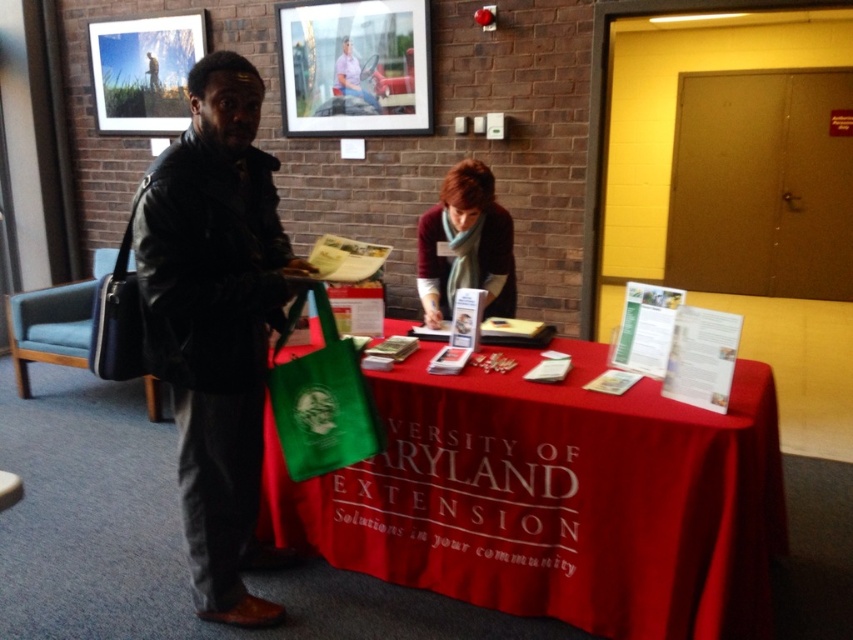
You are at the event and need to place a new sign on the table. The sign must be placed behind the green fabric bag at center but in front of the red cloth at center. Is this possible?

The red cloth at center is in front of the green fabric bag at center, so placing the sign behind the green fabric bag at center would place it further back than the red cloth. However, since the red cloth is already in front of the green bag, there is no space between them to place the sign behind the green bag but in front of the red cloth. Therefore, it is not possible.

You are a visitor at the event and see the red cloth at center and the maroon sweater at center. Which item is positioned higher?

The maroon sweater at center is positioned higher than the red cloth at center.

You are standing in front of the booth and want to pick up the maroon sweater at center. Is the red cloth at center blocking your access to it?

The red cloth at center is closer to the viewer than the maroon sweater at center, so the red cloth is blocking the maroon sweater at center. You would need to move the red cloth at center to access the maroon sweater at center.